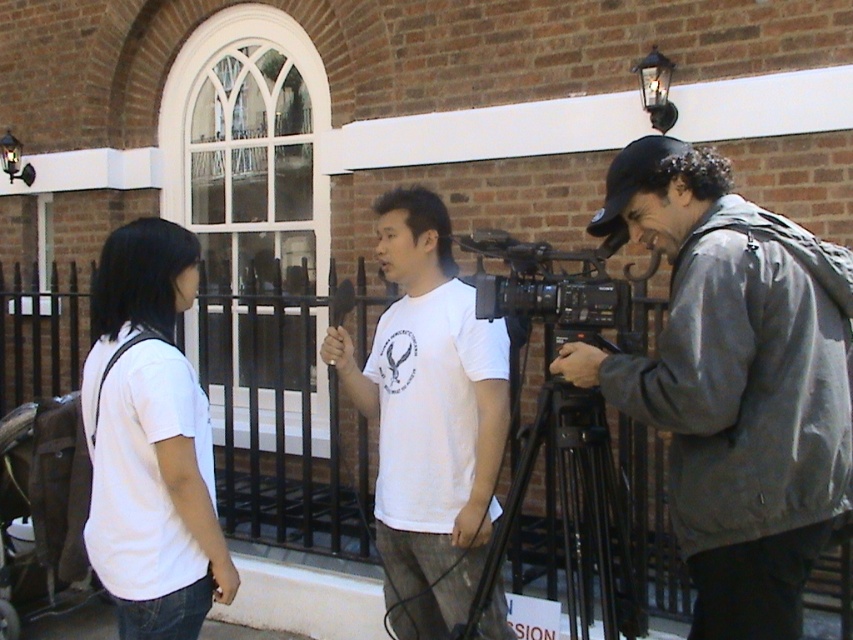
You are a photographer standing in front of the brick building. You need to position yourself so that both the gray fabric jacket at right and the black metal tripod at center are visible in your frame. Which object should you look at first to ensure both are in the shot?

You should look at the black metal tripod at center first because the gray fabric jacket at right is located above it, so by framing the tripod, you can ensure the jacket is also visible in the upper part of the frame.